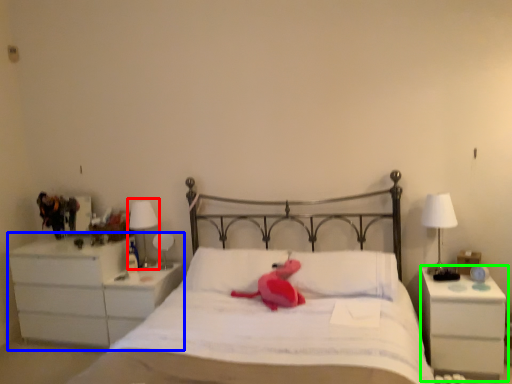
Question: Which object is the farthest from bedside lamp (highlighted by a red box)? Choose among these: chest of drawers (highlighted by a blue box) or nightstand (highlighted by a green box).

Choices:
 (A) chest of drawers
 (B) nightstand

Answer: (B)